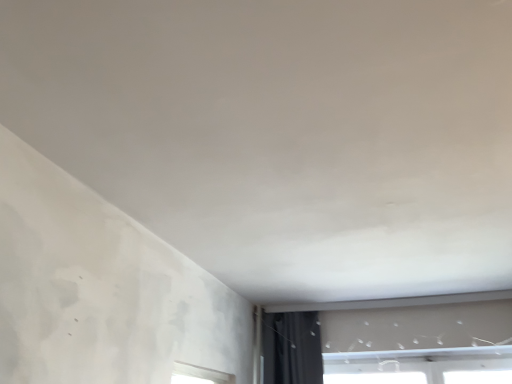
The height and width of the screenshot is (384, 512). Find the location of `white textured window at lower right`. white textured window at lower right is located at coordinates pyautogui.click(x=390, y=339).

What do you see at coordinates (390, 339) in the screenshot? I see `white textured window at lower right` at bounding box center [390, 339].

Where is `white textured window at lower right`? white textured window at lower right is located at coordinates (390, 339).